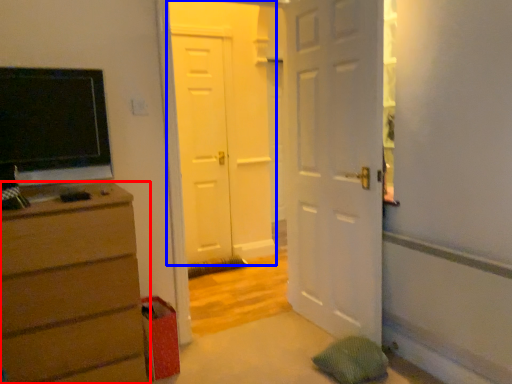
Question: Which object appears farthest to the camera in this image, chest of drawers (highlighted by a red box) or door (highlighted by a blue box)?

Choices:
 (A) chest of drawers
 (B) door

Answer: (B)